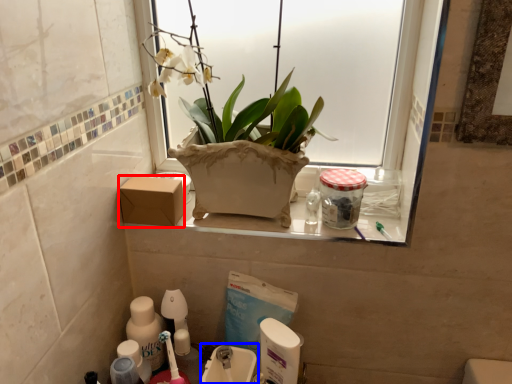
Question: Which object appears farthest to the camera in this image, cardboard box (highlighted by a red box) or sink (highlighted by a blue box)?

Choices:
 (A) cardboard box
 (B) sink

Answer: (A)